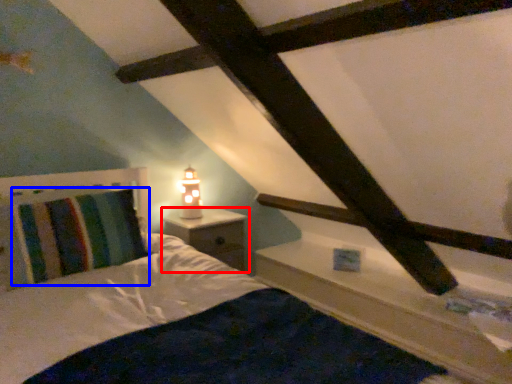
Question: Which of the following is the closest to the observer, nightstand (highlighted by a red box) or pillow (highlighted by a blue box)?

Choices:
 (A) nightstand
 (B) pillow

Answer: (B)